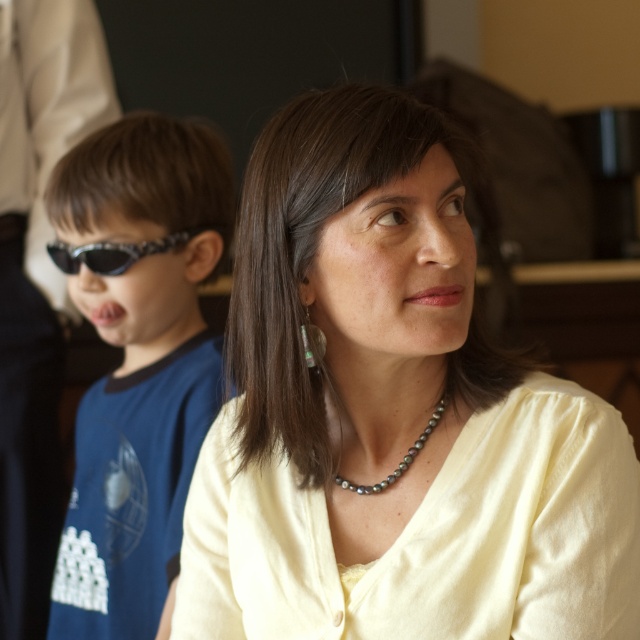
Question: Can you confirm if matte yellow blouse at center is positioned to the right of sunglasses at left?

Choices:
 (A) yes
 (B) no

Answer: (A)

Question: Does matte yellow blouse at center have a greater width compared to black plastic sunglasses at left?

Choices:
 (A) yes
 (B) no

Answer: (A)

Question: Which is nearer to the matte yellow blouse at center?

Choices:
 (A) sunglasses at left
 (B) pearl-like necklace at center

Answer: (B)

Question: Does matte yellow blouse at center appear on the right side of pearl-like necklace at center?

Choices:
 (A) yes
 (B) no

Answer: (B)

Question: Estimate the real-world distances between objects in this image. Which object is farther from the pearl-like necklace at center?

Choices:
 (A) matte yellow blouse at center
 (B) black plastic sunglasses at left

Answer: (B)

Question: Which object is the farthest from the black plastic sunglasses at left?

Choices:
 (A) sunglasses at left
 (B) pearl-like necklace at center

Answer: (B)